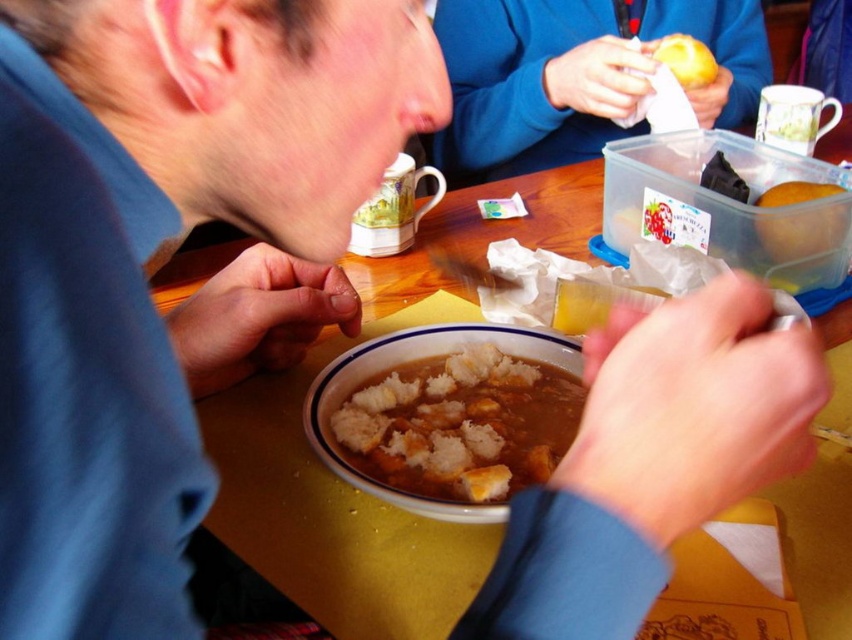
Consider the image. You are a waiter trying to place a new dish on the table. The dish is 25 centimeters wide. Can you fit it between the matte plastic container at upper center and the yellow wood table at center without moving any existing items?

The distance between the matte plastic container at upper center and the yellow wood table at center is 23.85 centimeters, which is less than the dish width of 25 centimeters. Therefore, the dish cannot be placed there without moving existing items.

You are a waiter who needs to place a new drink on the table. The table has a matte plastic container at upper center and a yellow matte apple at upper center. Which object should you place the drink closer to, the matte plastic container or the yellow matte apple, to ensure there is enough space?

The distance between the matte plastic container at upper center and the yellow matte apple at upper center is 6.72 inches. To ensure enough space, place the drink closer to the yellow matte apple at upper center as there might be more space available there.